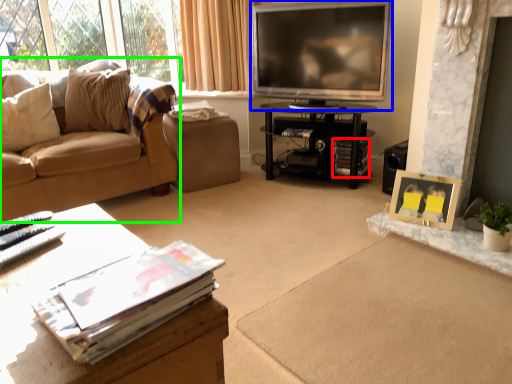
Question: Which object is positioned closest to magazine (highlighted by a red box)? Select from television (highlighted by a blue box) and studio couch (highlighted by a green box).

Choices:
 (A) television
 (B) studio couch

Answer: (A)